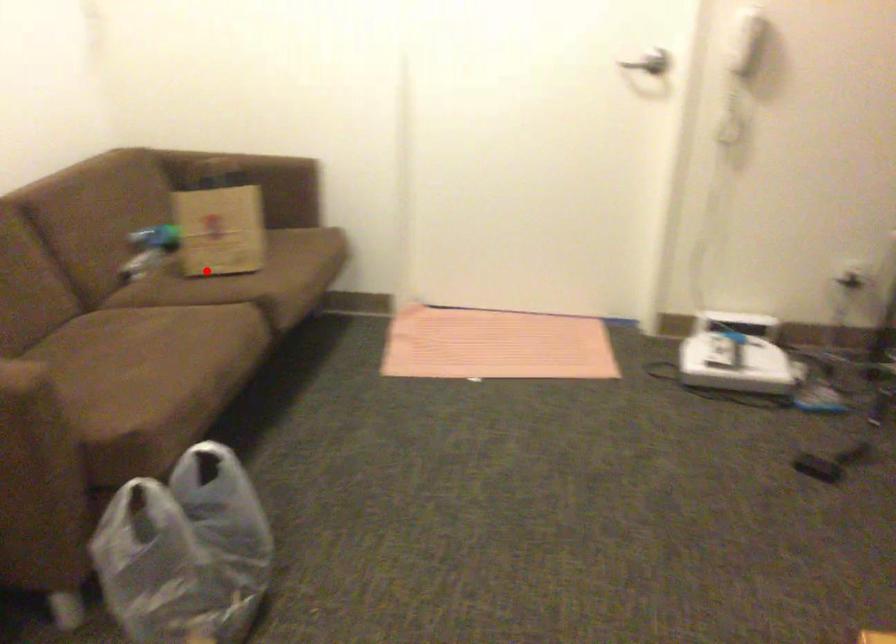
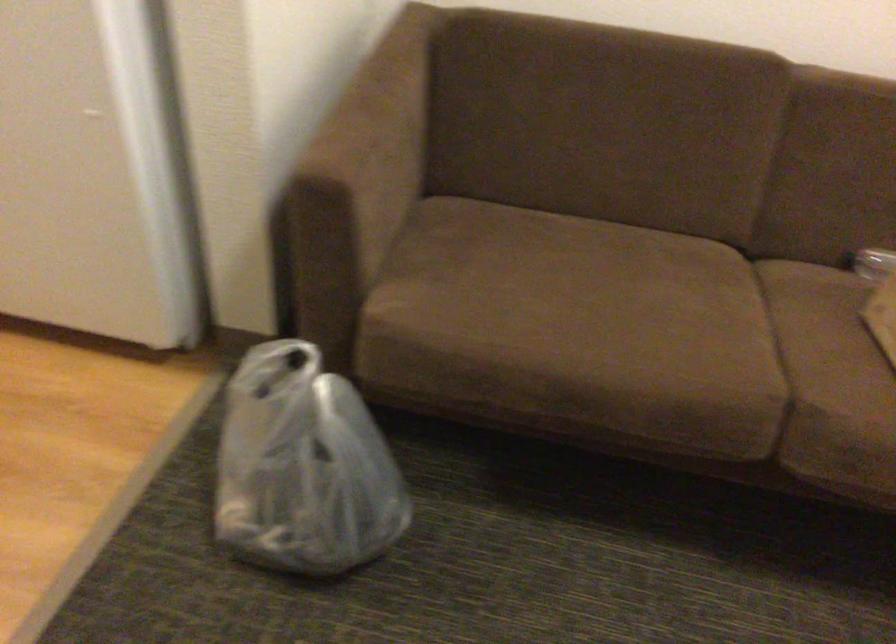
The point at the highlighted location is marked in the first image. Where is the corresponding point in the second image?

(882, 315)